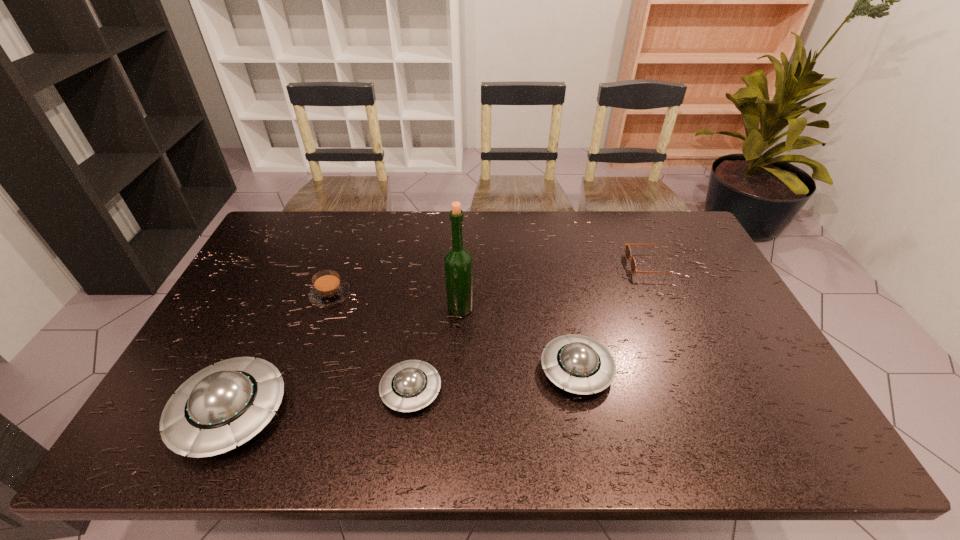
Where is `free space located 0.180m on the right of the second saucer from left to right`? This screenshot has width=960, height=540. free space located 0.180m on the right of the second saucer from left to right is located at coordinates (514, 390).

Where is `vacant region located 0.370m on the right of the third tallest object`? The image size is (960, 540). vacant region located 0.370m on the right of the third tallest object is located at coordinates (756, 370).

You are a GUI agent. You are given a task and a screenshot of the screen. Output one action in this format:
    pyautogui.click(x=<x>, y=<y>)
    Task: Click on the vacant area located 0.130m on the left of the cappuccino
    This screenshot has height=540, width=960.
    Given the screenshot: What is the action you would take?
    pyautogui.click(x=268, y=295)

The width and height of the screenshot is (960, 540). Find the location of `free region located 0.220m on the front-facing side of the farthest object`. free region located 0.220m on the front-facing side of the farthest object is located at coordinates (561, 266).

This screenshot has width=960, height=540. Identify the location of free spot located on the front-facing side of the farthest object. (516, 266).

Where is `vacant region located on the front-facing side of the farthest object`? The height and width of the screenshot is (540, 960). vacant region located on the front-facing side of the farthest object is located at coordinates (516, 266).

Locate an element on the screen. vacant point located 0.210m on the right of the tallest object is located at coordinates (544, 308).

Identify the location of object at the left edge. The image size is (960, 540). (226, 404).

I want to click on object positioned at the right edge, so click(x=633, y=266).

At what (x,y) coordinates should I click in order to perform the action: click on object situated at the near left corner. Please return your answer as a coordinate pair (x, y). Looking at the image, I should click on (226, 404).